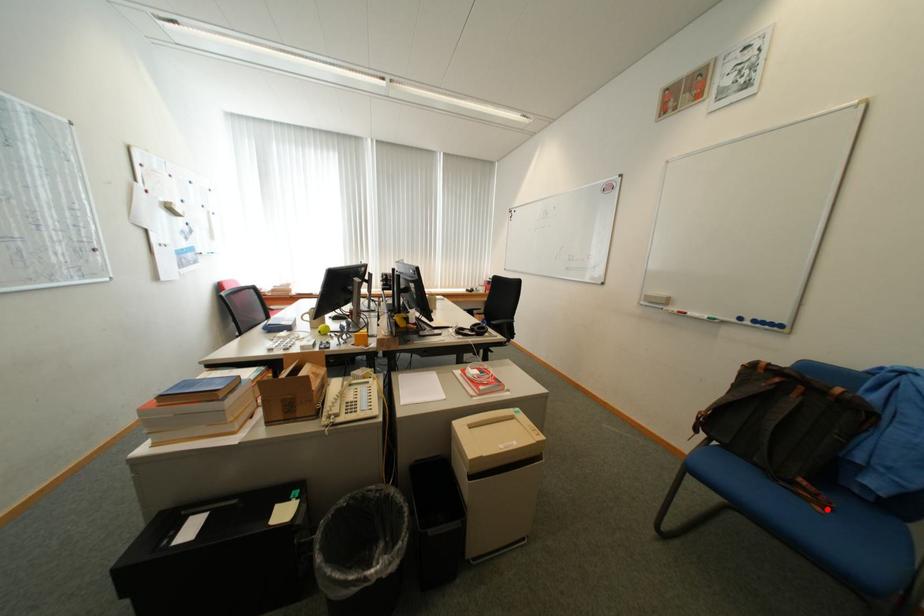
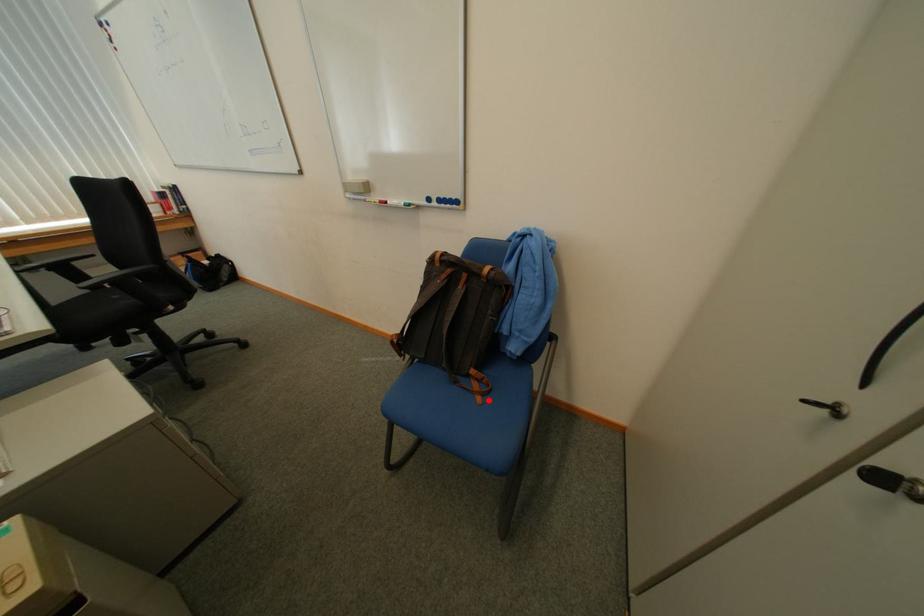
I am providing you with two images of the same scene from different viewpoints. A red point is marked on the first image and another point is marked on the second image. Does the point marked in image1 correspond to the same location as the one in image2?

Yes